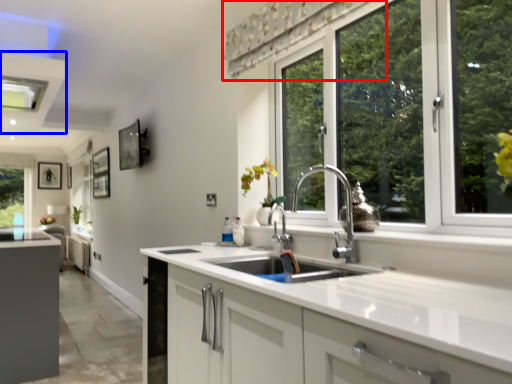
Question: Which object is closer to the camera taking this photo, curtain (highlighted by a red box) or exhaust hood (highlighted by a blue box)?

Choices:
 (A) curtain
 (B) exhaust hood

Answer: (A)